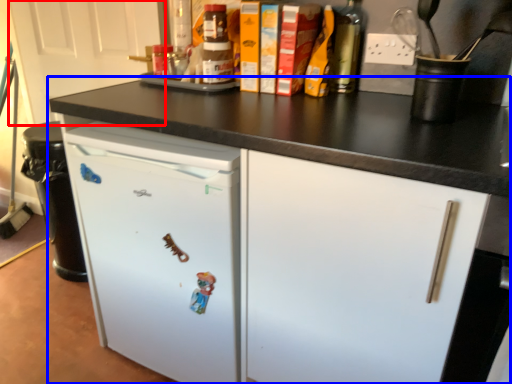
Question: Which object appears closest to the camera in this image, door (highlighted by a red box) or cabinetry (highlighted by a blue box)?

Choices:
 (A) door
 (B) cabinetry

Answer: (B)